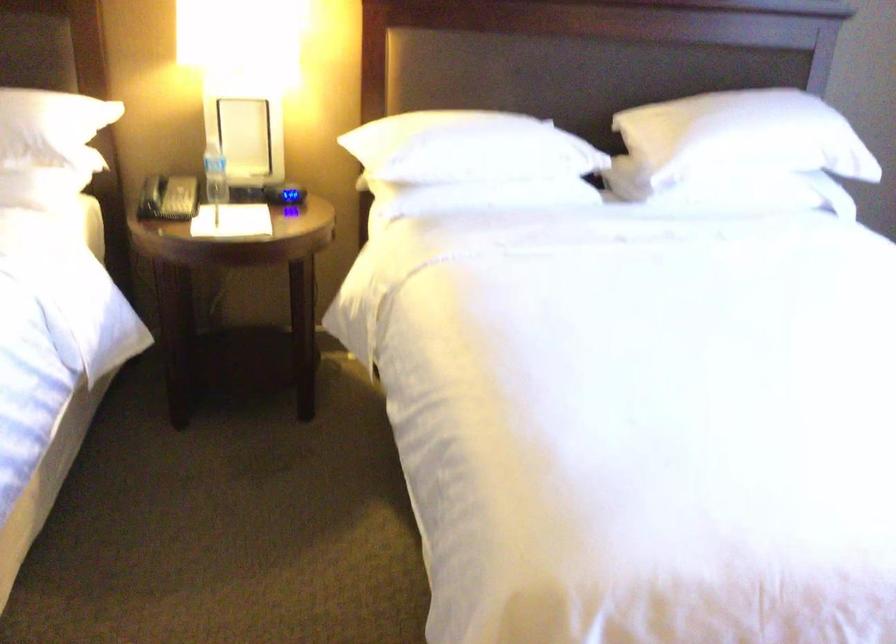
Find where to lift the white notepad. Please return your answer as a coordinate pair (x, y).

(231, 221)